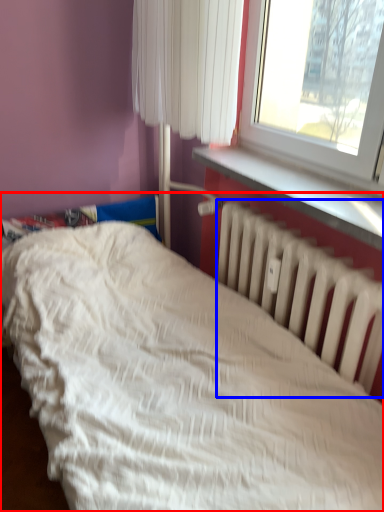
Question: Which point is further to the camera, bed (highlighted by a red box) or radiator (highlighted by a blue box)?

Choices:
 (A) bed
 (B) radiator

Answer: (B)